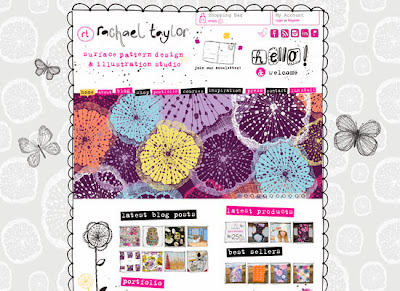
At what (x,y) coordinates should I click in order to perform the action: click on scalloped edging. Please return your answer as a coordinate pair (x, y). Image resolution: width=400 pixels, height=291 pixels. Looking at the image, I should click on tap(69, 205), tap(70, 163), tap(68, 50), tap(324, 43), tap(328, 115), tap(325, 187).